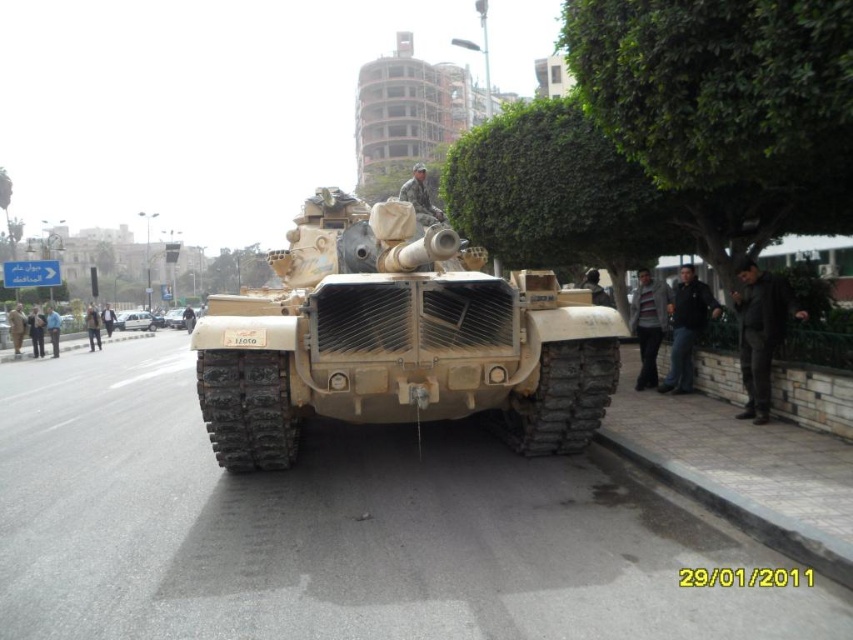
You are a military analyst observing the scene. You notice two tanks labeled as camouflage textured tank at center and camouflage fabric tank at center. Which one is positioned lower in the image?

The camouflage textured tank at center is positioned lower than the camouflage fabric tank at center according to the description.

Consider the image. You are a photographer standing in front of the camouflage textured tank at center and the camouflage fabric tank at center. You want to take a photo that includes both tanks but focuses on the one closer to you. Which tank should you focus on?

The camouflage textured tank at center is closer to the viewer than the camouflage fabric tank at center, so you should focus on the camouflage textured tank at center.

From the picture: Based on the scene description, where is the camouflage textured tank at center located in terms of its 2D coordinates?

The camouflage textured tank at center is located at the 2D coordinates of point (398, 339).